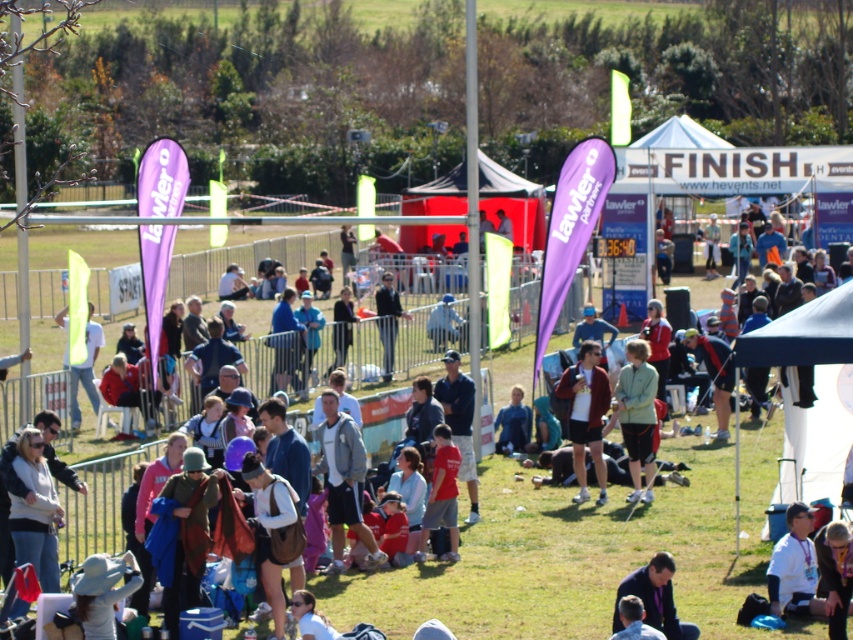
Is gray fabric jacket at center taller than dark blue shirt at lower center?

Yes, gray fabric jacket at center is taller than dark blue shirt at lower center.

The image size is (853, 640). Describe the element at coordinates (343, 481) in the screenshot. I see `gray fabric jacket at center` at that location.

Find the location of a particular element. The width and height of the screenshot is (853, 640). gray fabric jacket at center is located at coordinates (343, 481).

Is gray fabric jacket at center to the right of matte black jacket at center from the viewer's perspective?

Yes, gray fabric jacket at center is to the right of matte black jacket at center.

Between gray fabric jacket at center and matte black jacket at center, which one appears on the right side from the viewer's perspective?

Positioned to the right is gray fabric jacket at center.

Image resolution: width=853 pixels, height=640 pixels. Find the location of `gray fabric jacket at center`. gray fabric jacket at center is located at coordinates (343, 481).

Which is above, matte black jacket at center or light green fabric jacket at center?

light green fabric jacket at center is higher up.

Which is in front, point (283, 634) or point (624, 410)?

Point (283, 634) is in front.

Identify the location of matte black jacket at center. (271, 531).